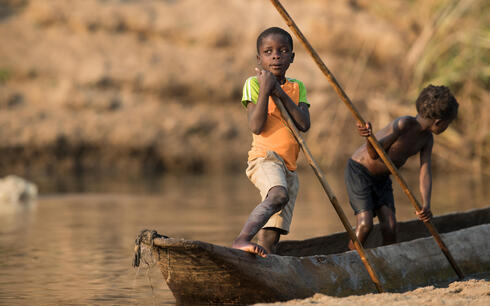
Find the location of `chest`. chest is located at coordinates (407, 145).